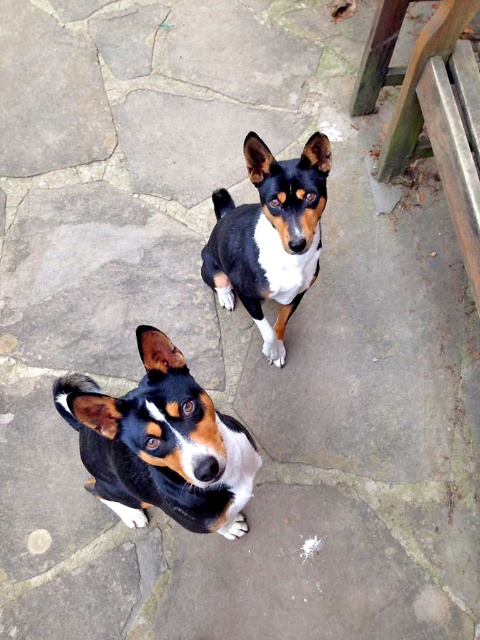
Question: Which object appears farthest from the camera in this image?

Choices:
 (A) black and white fur dog at center
 (B) smooth black and white dog at center

Answer: (A)

Question: Is smooth black and white dog at center further to the viewer compared to black and white fur dog at center?

Choices:
 (A) no
 (B) yes

Answer: (A)

Question: Is smooth black and white dog at center in front of black and white fur dog at center?

Choices:
 (A) yes
 (B) no

Answer: (A)

Question: Does smooth black and white dog at center appear under black and white fur dog at center?

Choices:
 (A) yes
 (B) no

Answer: (A)